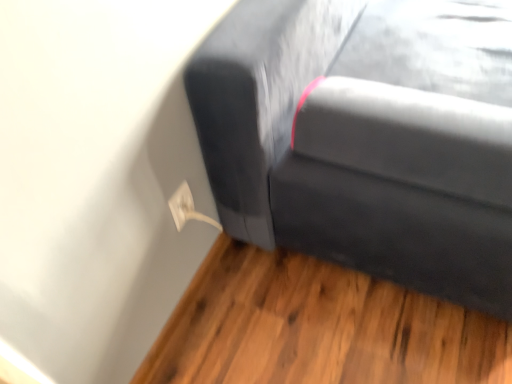
Question: From the image's perspective, is matte black couch at upper right above or below white plastic electric outlet at lower left?

Choices:
 (A) below
 (B) above

Answer: (A)

Question: Considering the positions of matte black couch at upper right and white plastic electric outlet at lower left in the image, is matte black couch at upper right taller or shorter than white plastic electric outlet at lower left?

Choices:
 (A) tall
 (B) short

Answer: (B)

Question: From a real-world perspective, is matte black couch at upper right physically located above or below white plastic electric outlet at lower left?

Choices:
 (A) above
 (B) below

Answer: (B)

Question: Looking at the image, does white plastic electric outlet at lower left seem bigger or smaller compared to matte black couch at upper right?

Choices:
 (A) big
 (B) small

Answer: (B)

Question: Visually, is white plastic electric outlet at lower left positioned to the left or to the right of matte black couch at upper right?

Choices:
 (A) right
 (B) left

Answer: (B)

Question: Does point (178, 220) appear closer or farther from the camera than point (426, 92)?

Choices:
 (A) farther
 (B) closer

Answer: (A)

Question: Which is correct: white plastic electric outlet at lower left is inside matte black couch at upper right, or outside of it?

Choices:
 (A) inside
 (B) outside

Answer: (B)